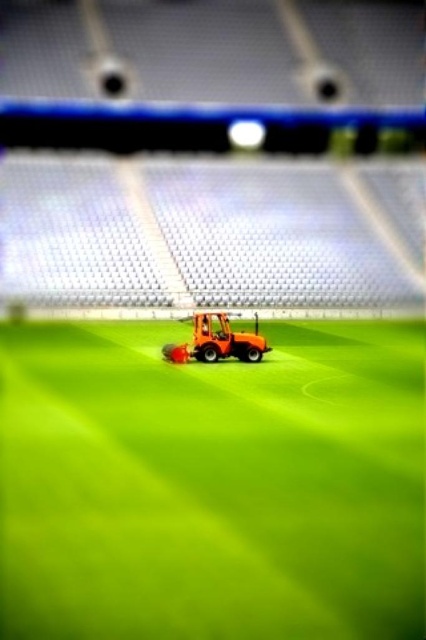
Question: Among these objects, which one is nearest to the camera?

Choices:
 (A) green smooth grass at center
 (B) orange plastic lawn mower at center

Answer: (A)

Question: Does green smooth grass at center appear on the right side of orange plastic lawn mower at center?

Choices:
 (A) no
 (B) yes

Answer: (B)

Question: Does green smooth grass at center have a greater width compared to orange plastic lawn mower at center?

Choices:
 (A) yes
 (B) no

Answer: (A)

Question: Which point is closer to the camera?

Choices:
 (A) (161, 364)
 (B) (238, 356)

Answer: (A)

Question: Which point appears closest to the camera in this image?

Choices:
 (A) (138, 397)
 (B) (241, 348)

Answer: (A)

Question: Is green smooth grass at center to the right of orange plastic lawn mower at center from the viewer's perspective?

Choices:
 (A) yes
 (B) no

Answer: (A)